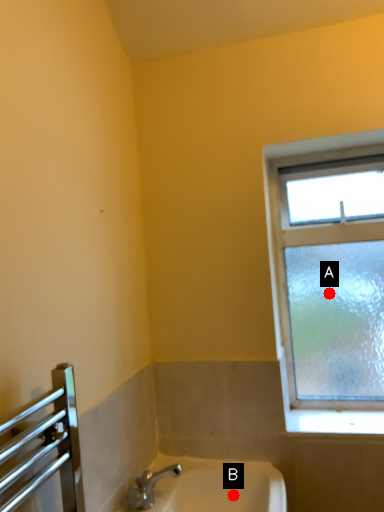
Question: Two points are circled on the image, labeled by A and B beside each circle. Which point is farther to the camera?

Choices:
 (A) A is further
 (B) B is further

Answer: (A)